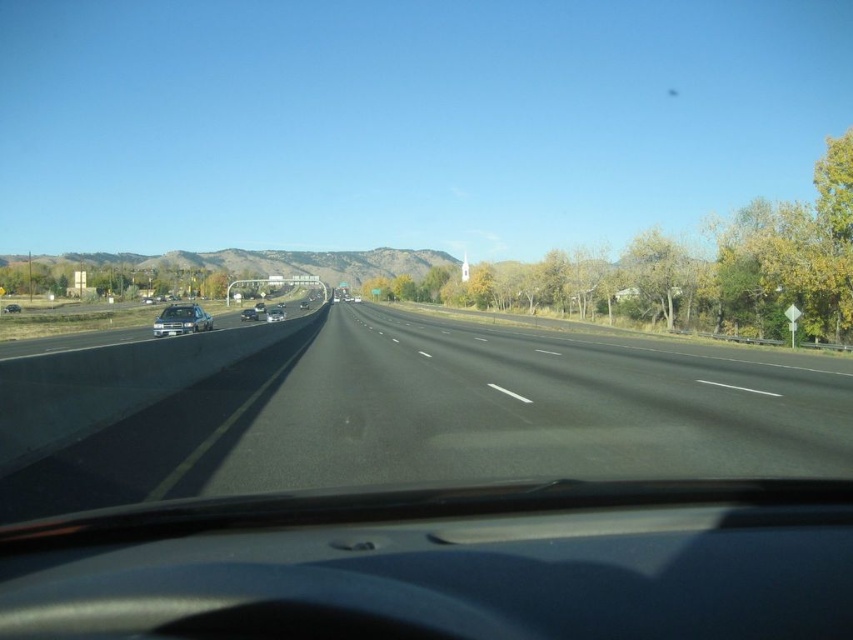
Question: Considering the relative positions of shiny black sedan at left and matte black sedan at center in the image provided, where is shiny black sedan at left located with respect to matte black sedan at center?

Choices:
 (A) right
 (B) left

Answer: (B)

Question: Which point is farther to the camera?

Choices:
 (A) (254, 310)
 (B) (746, 460)
 (C) (276, 310)

Answer: (A)

Question: Which object is the farthest from the black asphalt highway at center?

Choices:
 (A) satin black sedan at center
 (B) satin silver sedan at left

Answer: (A)

Question: Does satin black sedan at center come in front of shiny black sedan at left?

Choices:
 (A) yes
 (B) no

Answer: (A)

Question: Based on their relative distances, which object is farther from the satin silver sedan at center?

Choices:
 (A) satin black sedan at center
 (B) shiny black sedan at left

Answer: (B)

Question: Does satin silver sedan at center come in front of matte black sedan at center?

Choices:
 (A) no
 (B) yes

Answer: (B)